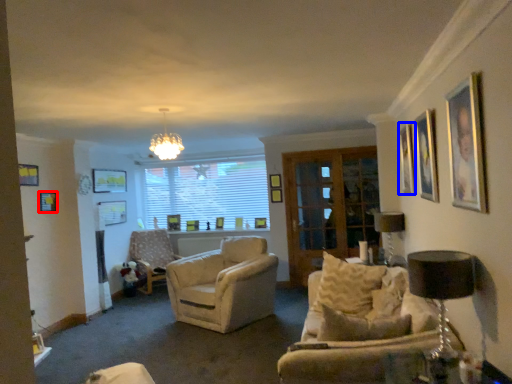
Question: Which of the following is the closest to the observer, picture frame (highlighted by a red box) or picture frame (highlighted by a blue box)?

Choices:
 (A) picture frame
 (B) picture frame

Answer: (B)